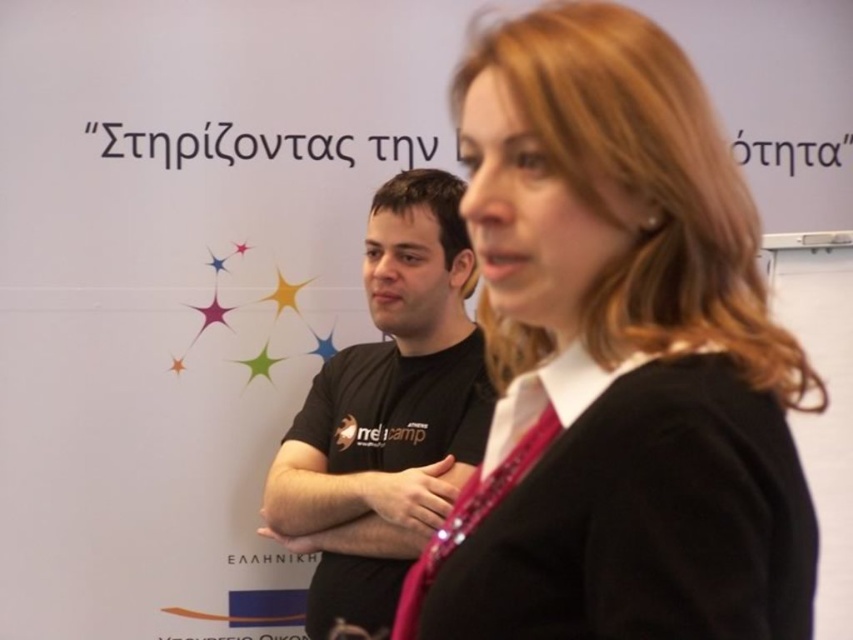
Question: Is black matte jacket at center further to the viewer compared to black matte t-shirt at center?

Choices:
 (A) no
 (B) yes

Answer: (A)

Question: Which object appears closest to the camera in this image?

Choices:
 (A) black matte t-shirt at center
 (B) black matte jacket at center

Answer: (B)

Question: Among these points, which one is nearest to the camera?

Choices:
 (A) (312, 432)
 (B) (706, 387)

Answer: (B)

Question: Can you confirm if black matte jacket at center is bigger than black matte t-shirt at center?

Choices:
 (A) yes
 (B) no

Answer: (B)

Question: Can you confirm if black matte jacket at center is thinner than black matte t-shirt at center?

Choices:
 (A) yes
 (B) no

Answer: (A)

Question: Among these points, which one is farthest from the camera?

Choices:
 (A) (350, 445)
 (B) (480, 512)

Answer: (A)